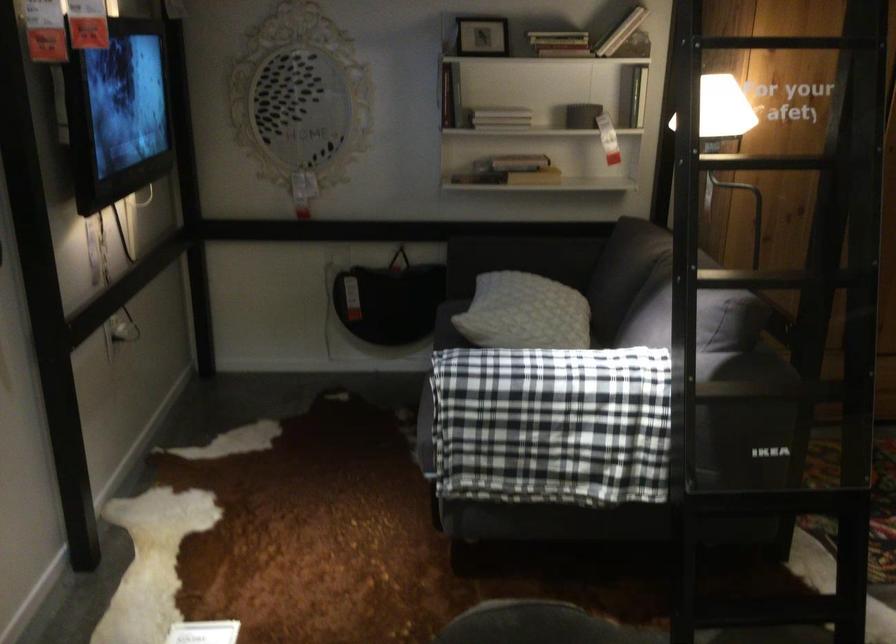
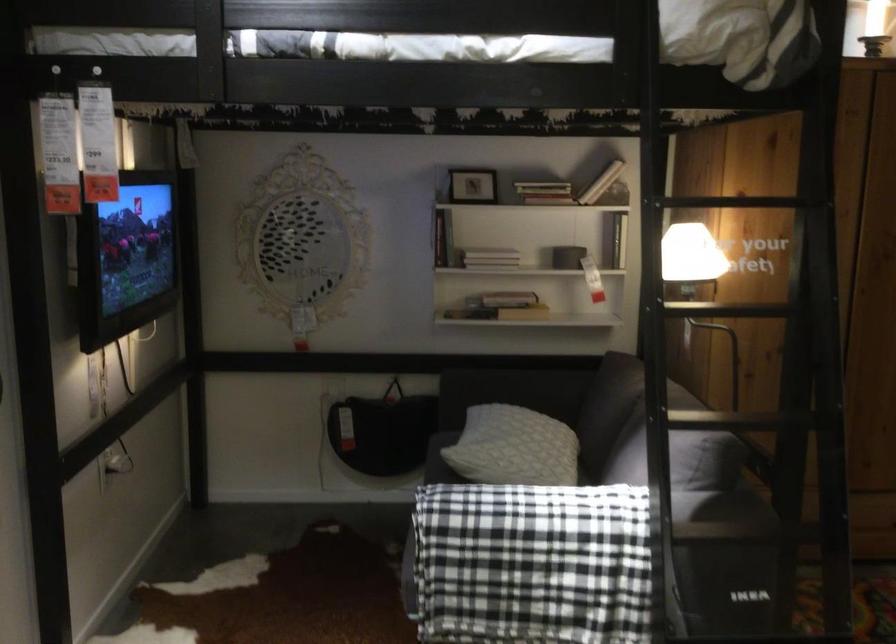
Which direction would the cameraman need to move to produce the second image?

The cameraman walked toward right, backward.